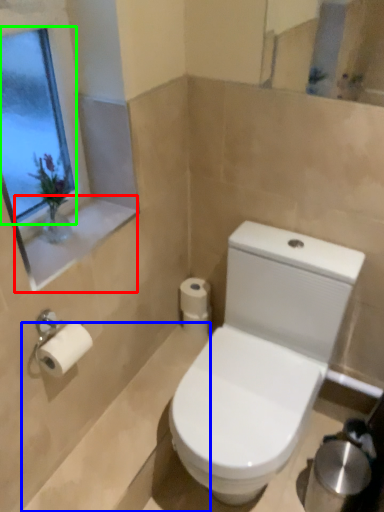
Question: Which object is positioned farthest from window sill (highlighted by a red box)? Select from bath (highlighted by a blue box) and window screen (highlighted by a green box).

Choices:
 (A) bath
 (B) window screen

Answer: (A)